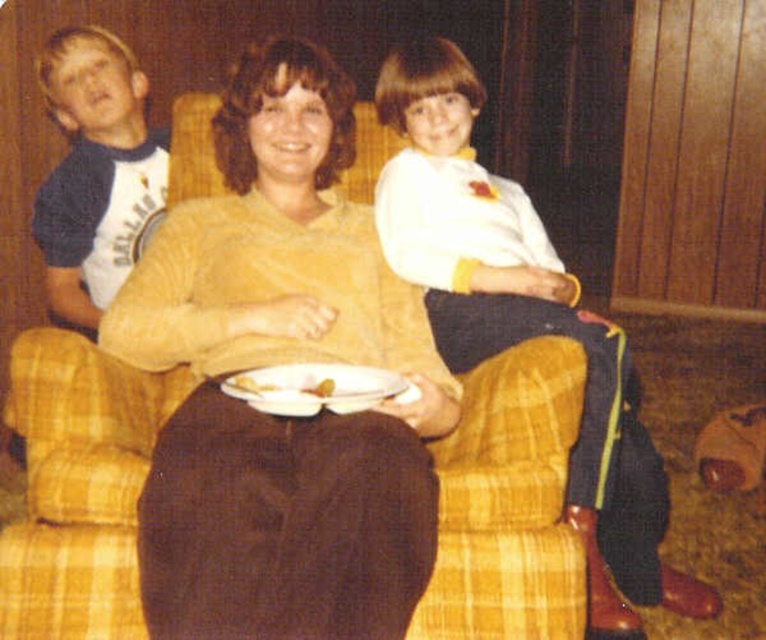
Based on the scene description, where exactly is the brown fabric at center located in the image?

The brown fabric at center is located at point [283,524].

You are standing in the room and want to take a photo of the point at coordinates point (90,225). Can you estimate how far you need to move forward to get the point in focus if your camera requires the subject to be exactly 2 meters away?

The point point (90,225) is 2.18 meters away from the camera. To get it to exactly 2 meters, you need to move forward by 0.18 meters.